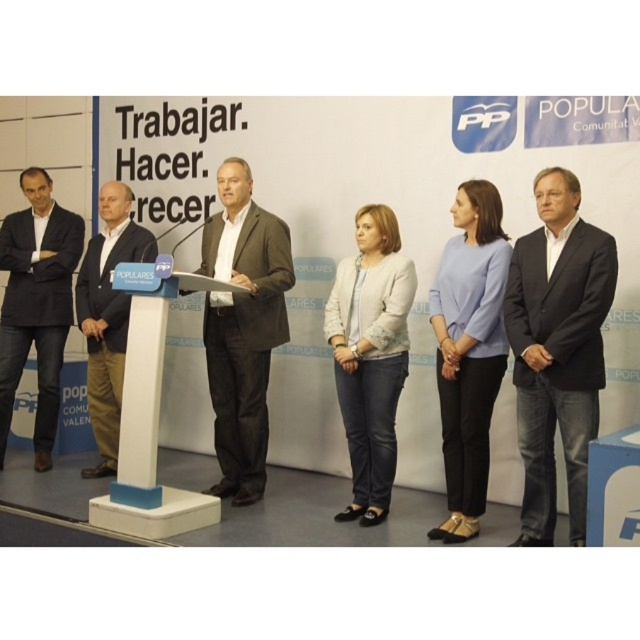
You are attending a formal event and notice two attendees wearing dark gray suit at center and light gray textured blazer at center. Which one is positioned to the left?

The dark gray suit at center is positioned to the left of the light gray textured blazer at center.